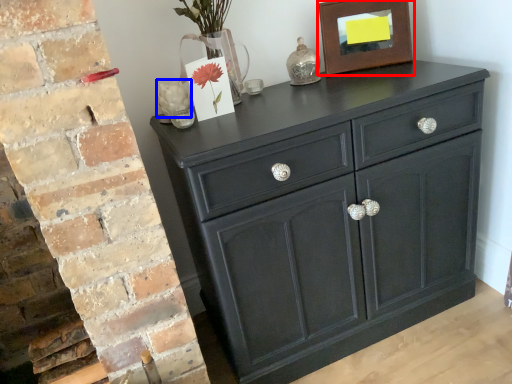
Question: Which object appears farthest to the camera in this image, picture frame (highlighted by a red box) or flower (highlighted by a blue box)?

Choices:
 (A) picture frame
 (B) flower

Answer: (A)